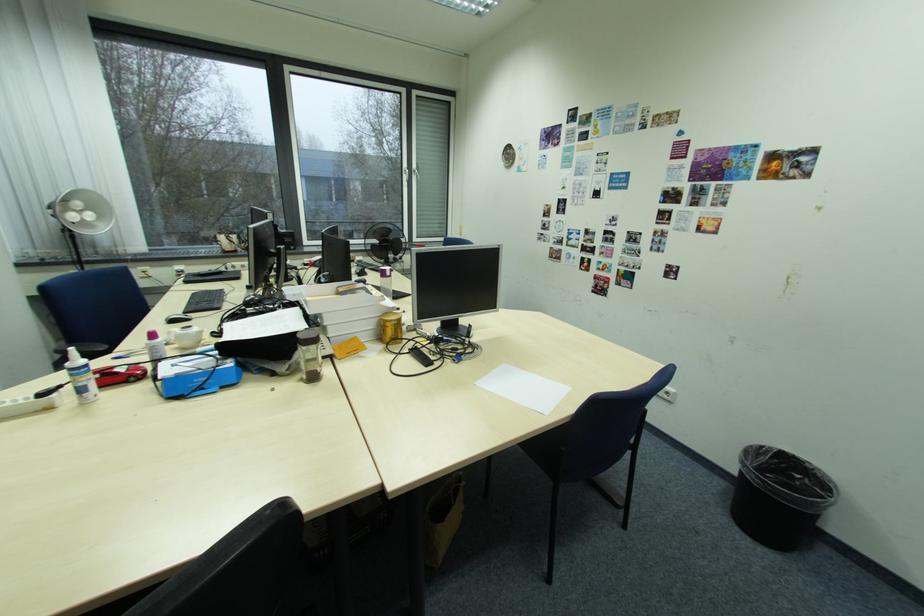
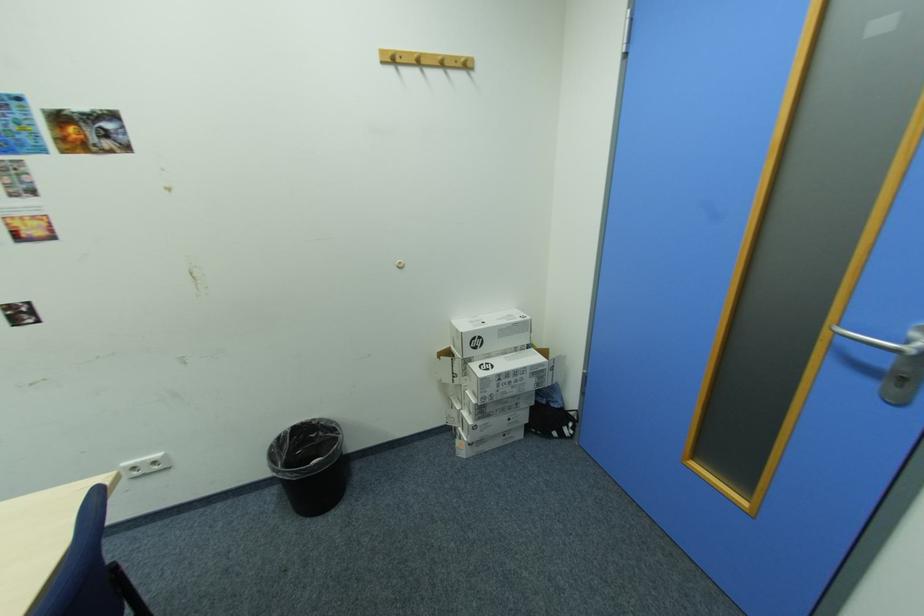
Where in the second image is the point corresponding to (807,477) from the first image?

(322, 436)